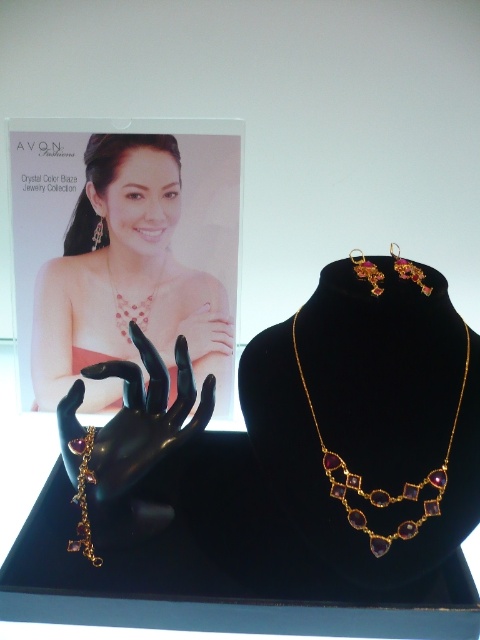
Who is lower down, amber-golden metal necklace at center or shiny gold necklace at center?

amber-golden metal necklace at center

Between point (344, 490) and point (131, 314), which one is positioned in front?

Point (344, 490)

You are a GUI agent. You are given a task and a screenshot of the screen. Output one action in this format:
    pyautogui.click(x=<x>, y=<y>)
    Task: Click on the amber-golden metal necklace at center
    This screenshot has width=480, height=640.
    Given the screenshot: What is the action you would take?
    pyautogui.click(x=381, y=488)

Who is more forward, [118,300] or [98,236]?

Positioned in front is point [98,236].

What do you see at coordinates (132, 305) in the screenshot? I see `shiny gold necklace at center` at bounding box center [132, 305].

Locate an element on the screen. shiny gold necklace at center is located at coordinates (132, 305).

Is amber-gold chain bracelet at lower left to the left of gold shiny earrings at upper right from the viewer's perspective?

Indeed, amber-gold chain bracelet at lower left is positioned on the left side of gold shiny earrings at upper right.

Can you confirm if amber-gold chain bracelet at lower left is taller than gold shiny earrings at upper right?

Indeed, amber-gold chain bracelet at lower left has a greater height compared to gold shiny earrings at upper right.

At what (x,y) coordinates should I click in order to perform the action: click on amber-gold chain bracelet at lower left. Please return your answer as a coordinate pair (x, y). The height and width of the screenshot is (640, 480). Looking at the image, I should click on coord(84,497).

At what (x,y) coordinates should I click in order to perform the action: click on amber-gold chain bracelet at lower left. Please return your answer as a coordinate pair (x, y). The height and width of the screenshot is (640, 480). Looking at the image, I should click on (84, 497).